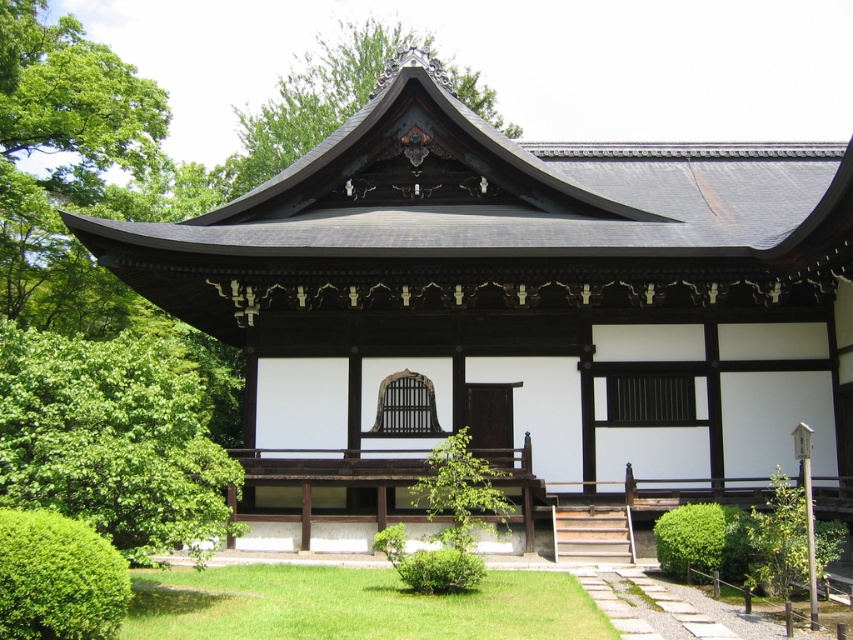
You are standing in front of the traditional Japanese temple and want to determine the relative positions of two points marked on the structure. Which point is closer to you, point (166, 403) or point (309, 113)?

Point (166, 403) is closer to the viewer than point (309, 113).

You are a landscape architect designing a new garden. You have two green leafy trees to place in the garden. The first is the green leafy tree at lower left and the second is the green leafy tree at upper center. Given that the garden has a maximum allowable distance of 30 meters between any two trees, will the placement of these two trees comply with the garden design guidelines?

The distance between the green leafy tree at lower left and the green leafy tree at upper center is 29.24 meters, which is under the 30 meters maximum allowable distance. Therefore, their placement complies with the garden design guidelines.

You are standing in front of the temple and see two green leafy trees. One is the green leafy tree at lower left and the other is the green leafy tree at upper center. Which tree is closer to you?

The green leafy tree at lower left is closer to you because it is in front of the green leafy tree at upper center.